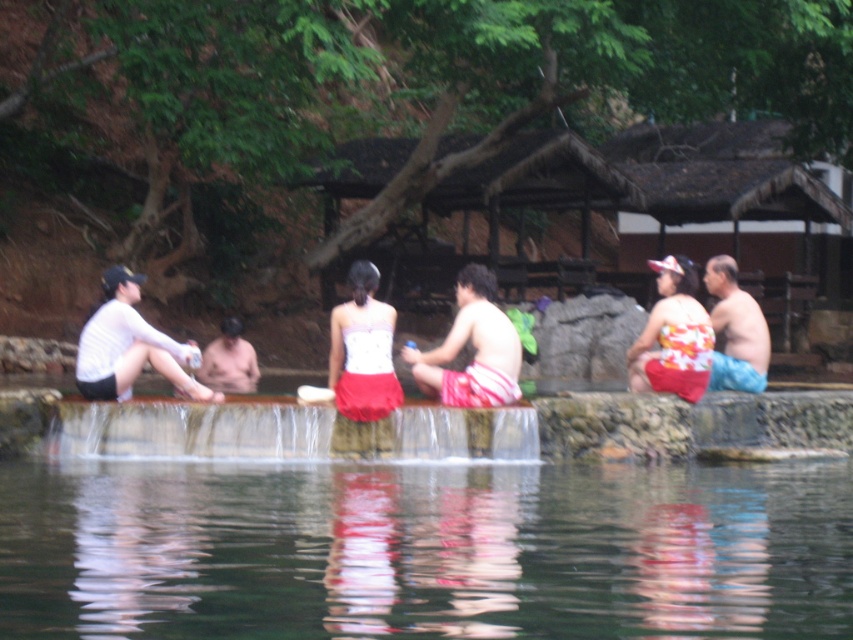
Consider the image. You are standing at the edge of the pool and want to step into the transparent water at center. Based on the coordinates provided, is the water directly in front of you or to your side?

The transparent water at center is located at coordinates point [424,550], which places it directly in front of you since it is at the center of the scene.

Based on the photo, you are standing at the center of the pool and want to find the blue fabric shorts at right. Which direction should you look to see the point at coordinates (735, 330)?

The point at coordinates (735, 330) is located on the blue fabric shorts at right, so you should look to your right to see it.